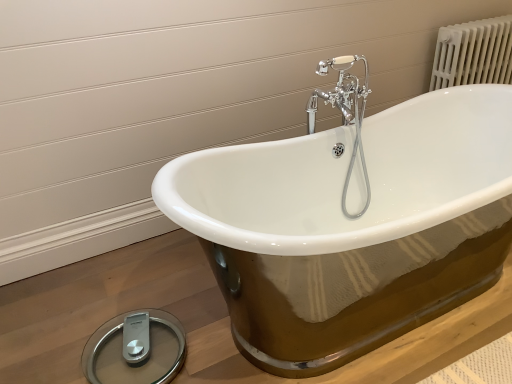
Question: Is silver/glass scale at lower left further to the viewer compared to chrome/metallic faucet at upper center?

Choices:
 (A) yes
 (B) no

Answer: (B)

Question: Does silver/glass scale at lower left appear on the left side of chrome/metallic faucet at upper center?

Choices:
 (A) no
 (B) yes

Answer: (B)

Question: Are silver/glass scale at lower left and chrome/metallic faucet at upper center located far from each other?

Choices:
 (A) yes
 (B) no

Answer: (A)

Question: Is silver/glass scale at lower left closer to the viewer compared to chrome/metallic faucet at upper center?

Choices:
 (A) yes
 (B) no

Answer: (A)

Question: Does silver/glass scale at lower left have a lesser width compared to chrome/metallic faucet at upper center?

Choices:
 (A) yes
 (B) no

Answer: (B)

Question: Does silver/glass scale at lower left have a smaller size compared to chrome/metallic faucet at upper center?

Choices:
 (A) no
 (B) yes

Answer: (B)

Question: Does chrome/metallic faucet at upper center have a greater width compared to silver/glass scale at lower left?

Choices:
 (A) yes
 (B) no

Answer: (B)

Question: Is chrome/metallic faucet at upper center at the left side of silver/glass scale at lower left?

Choices:
 (A) no
 (B) yes

Answer: (A)

Question: Is the depth of chrome/metallic faucet at upper center greater than that of silver/glass scale at lower left?

Choices:
 (A) yes
 (B) no

Answer: (A)

Question: Is chrome/metallic faucet at upper center smaller than silver/glass scale at lower left?

Choices:
 (A) no
 (B) yes

Answer: (A)

Question: Is chrome/metallic faucet at upper center facing away from silver/glass scale at lower left?

Choices:
 (A) yes
 (B) no

Answer: (B)

Question: Can silver/glass scale at lower left be found inside chrome/metallic faucet at upper center?

Choices:
 (A) no
 (B) yes

Answer: (A)

Question: Does white porcelain bathtub at center have a lesser height compared to chrome/metallic faucet at upper center?

Choices:
 (A) no
 (B) yes

Answer: (B)